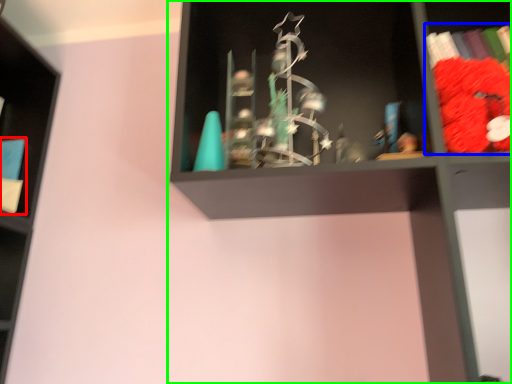
Question: Considering the real-world distances, which object is closest to book (highlighted by a red box)? book (highlighted by a blue box) or shelf (highlighted by a green box).

Choices:
 (A) book
 (B) shelf

Answer: (B)